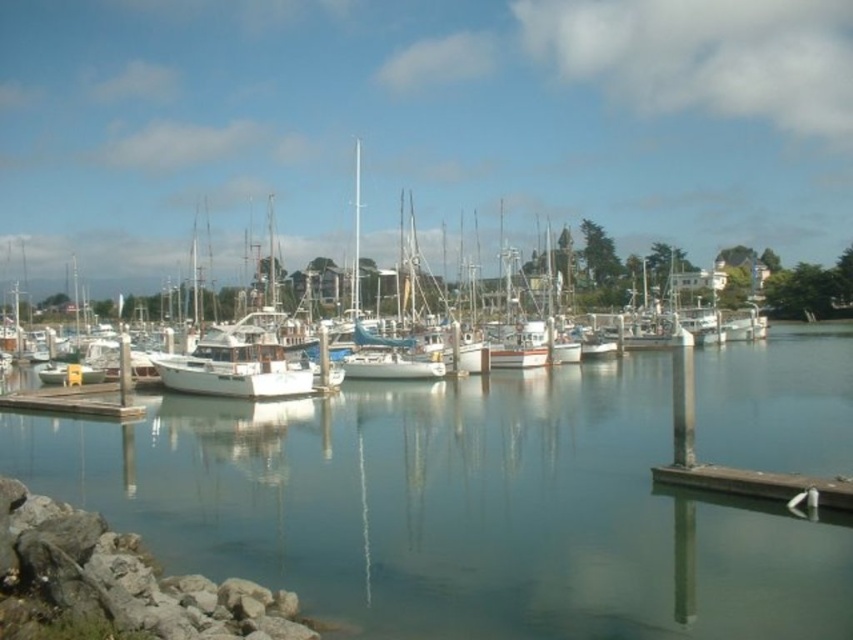
You are a photographer planning to capture the white matte boat at center and the wooden dock at lower left in a single frame. Considering their sizes, which object will appear bigger in the photo?

The white matte boat at center will appear bigger in the photo because it has a larger size compared to the wooden dock at lower left according to the description.